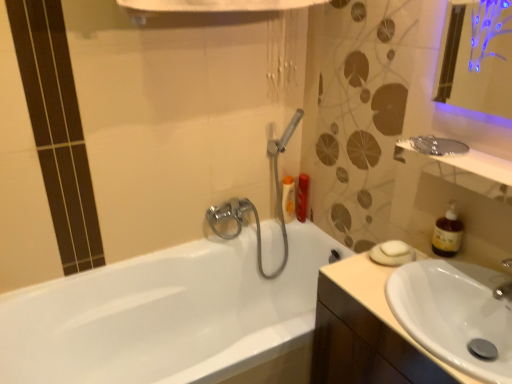
Question: Is white glossy sink at lower right shorter than metallic silver mirror at upper right?

Choices:
 (A) no
 (B) yes

Answer: (A)

Question: Considering the relative sizes of white glossy sink at lower right and metallic silver mirror at upper right in the image provided, is white glossy sink at lower right wider than metallic silver mirror at upper right?

Choices:
 (A) no
 (B) yes

Answer: (B)

Question: Does white glossy sink at lower right come behind metallic silver mirror at upper right?

Choices:
 (A) yes
 (B) no

Answer: (B)

Question: Is white glossy sink at lower right outside of metallic silver mirror at upper right?

Choices:
 (A) no
 (B) yes

Answer: (B)

Question: Is white glossy sink at lower right surrounding metallic silver mirror at upper right?

Choices:
 (A) no
 (B) yes

Answer: (A)

Question: Is white glossy sink at lower right at the right side of metallic silver mirror at upper right?

Choices:
 (A) yes
 (B) no

Answer: (B)

Question: From the image's perspective, is beige wood cabinet at lower right beneath white glossy sink at lower right?

Choices:
 (A) yes
 (B) no

Answer: (A)

Question: Does beige wood cabinet at lower right have a larger size compared to white glossy sink at lower right?

Choices:
 (A) yes
 (B) no

Answer: (A)

Question: Considering the relative sizes of beige wood cabinet at lower right and white glossy sink at lower right in the image provided, is beige wood cabinet at lower right shorter than white glossy sink at lower right?

Choices:
 (A) no
 (B) yes

Answer: (A)

Question: Is the position of beige wood cabinet at lower right less distant than that of white glossy sink at lower right?

Choices:
 (A) yes
 (B) no

Answer: (B)

Question: Does beige wood cabinet at lower right appear on the right side of white glossy sink at lower right?

Choices:
 (A) yes
 (B) no

Answer: (B)

Question: Does beige wood cabinet at lower right appear on the left side of white glossy sink at lower right?

Choices:
 (A) no
 (B) yes

Answer: (B)

Question: Can white glossy sink at lower right be found inside matte plastic shampoo bottle at upper right, which appears as the 1th toiletry when viewed from the right?

Choices:
 (A) yes
 (B) no

Answer: (B)